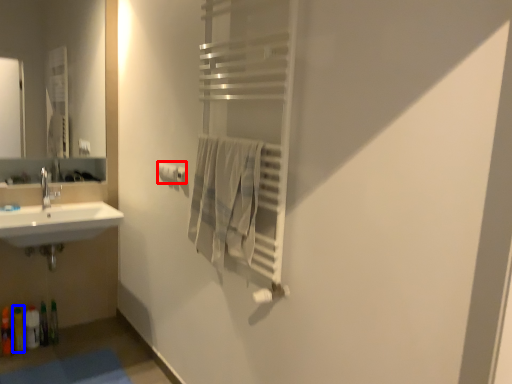
Question: Which of the following is the closest to the observer, toilet paper (highlighted by a red box) or toiletry (highlighted by a blue box)?

Choices:
 (A) toilet paper
 (B) toiletry

Answer: (A)